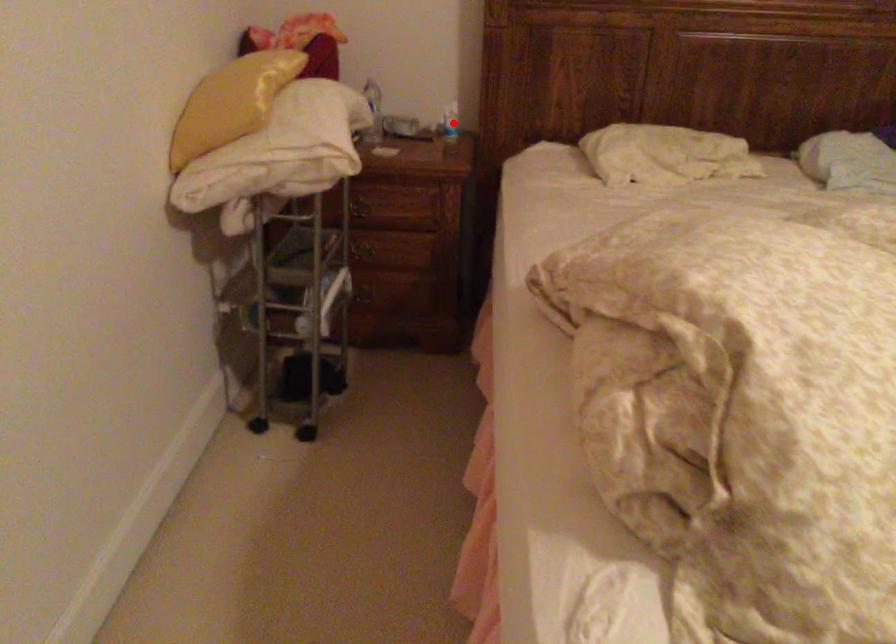
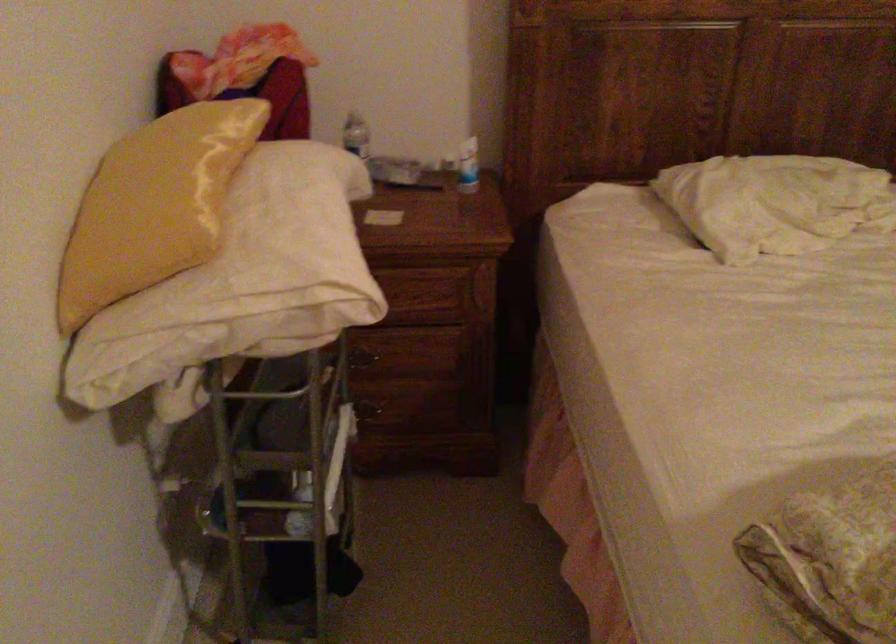
Question: I am providing you with two images of the same scene from different viewpoints. Given a red point in image1, look at the same physical point in image2. Is it:

Choices:
 (A) Closer to the viewpoint
 (B) Farther from the viewpoint

Answer: (A)